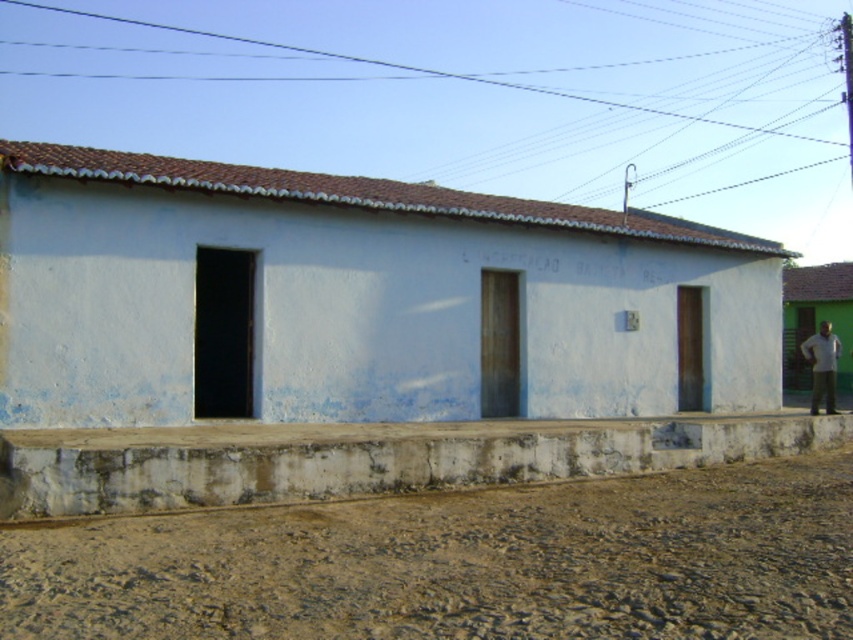
You are standing in front of the building and want to determine the relative positions of two points marked on the structure. Which point is closer to you, point 1 at coordinates point (x=125, y=268) or point 2 at coordinates point (x=810, y=330)?

Point 1 at coordinates point (x=125, y=268) is closer to you than point 2 at coordinates point (x=810, y=330).

You are standing in front of the building and see the brown gravel at lower center and the white cotton shirt at right. Which object is closer to the left side of the building?

The brown gravel at lower center is positioned on the left side of the white cotton shirt at right, so it is closer to the left side of the building.